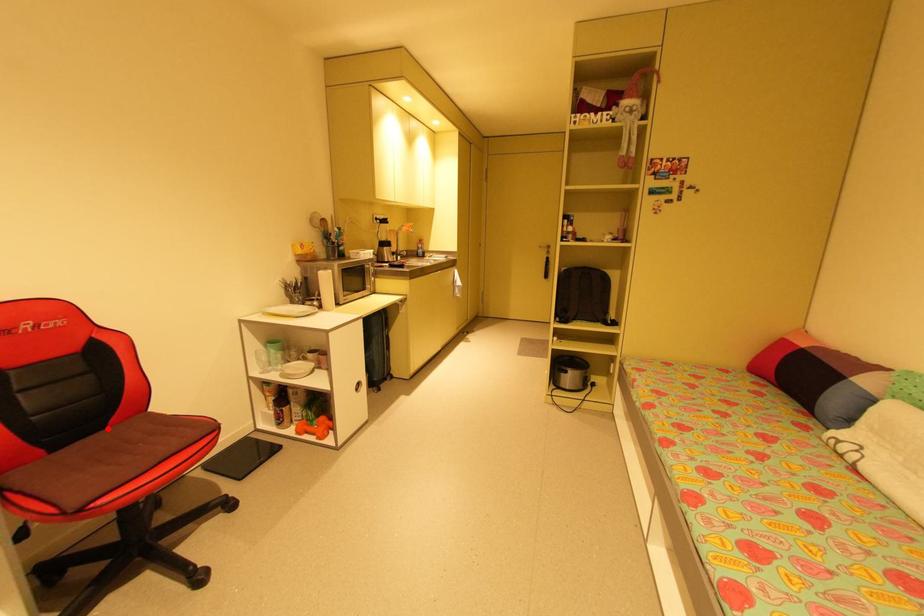
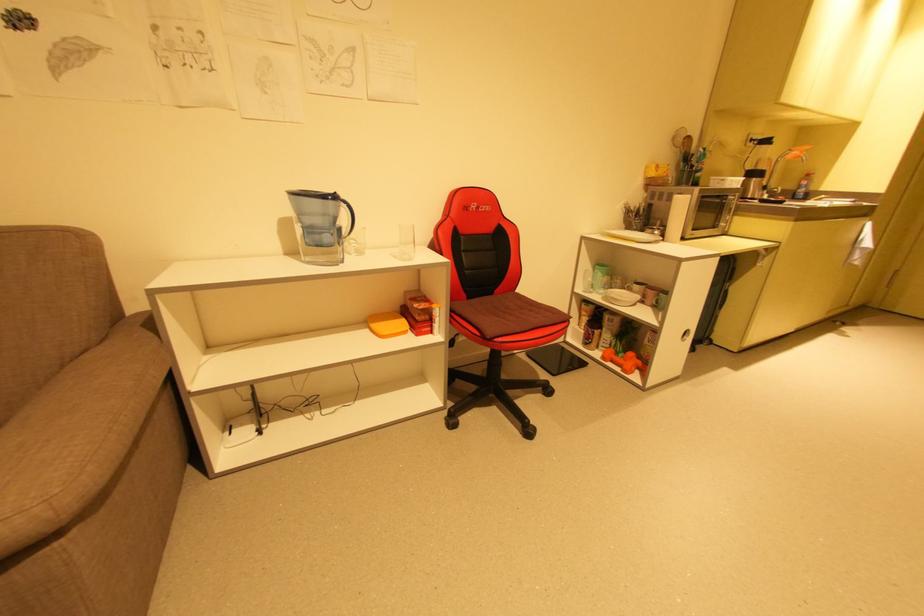
Locate, in the second image, the point that corresponds to the highlighted location in the first image.

(495, 294)